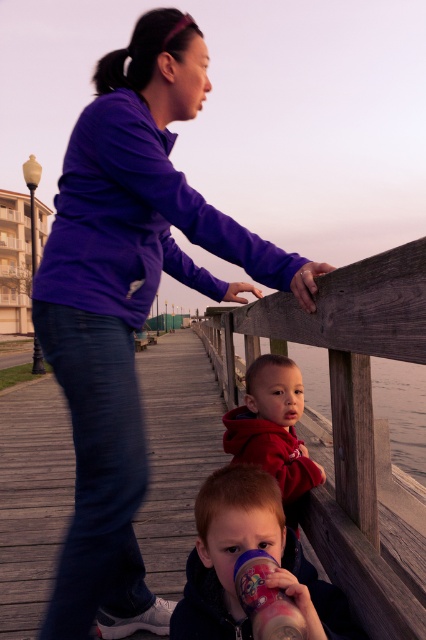
You are a photographer trying to capture both the dark blue fleece jacket at lower center and the matte plastic sippy cup at lower center in the same frame. Since you want to ensure both are clearly visible, which object should you focus on first to avoid blurring due to their size difference?

You should focus on the dark blue fleece jacket at lower center first because it is larger than the matte plastic sippy cup at lower center, making it more likely to remain in focus while adjusting the camera settings.

You are a parent trying to decide which fleece jacket to take for your child. Both the purple fleece jacket at upper center and the dark blue fleece jacket at lower center are available. Based on the image, which one is wider?

The purple fleece jacket at upper center is wider than the dark blue fleece jacket at lower center because its width surpasses the latter.